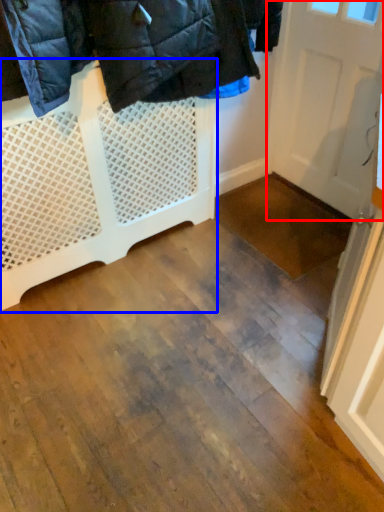
Question: Among these objects, which one is farthest to the camera, door (highlighted by a red box) or furniture (highlighted by a blue box)?

Choices:
 (A) door
 (B) furniture

Answer: (A)